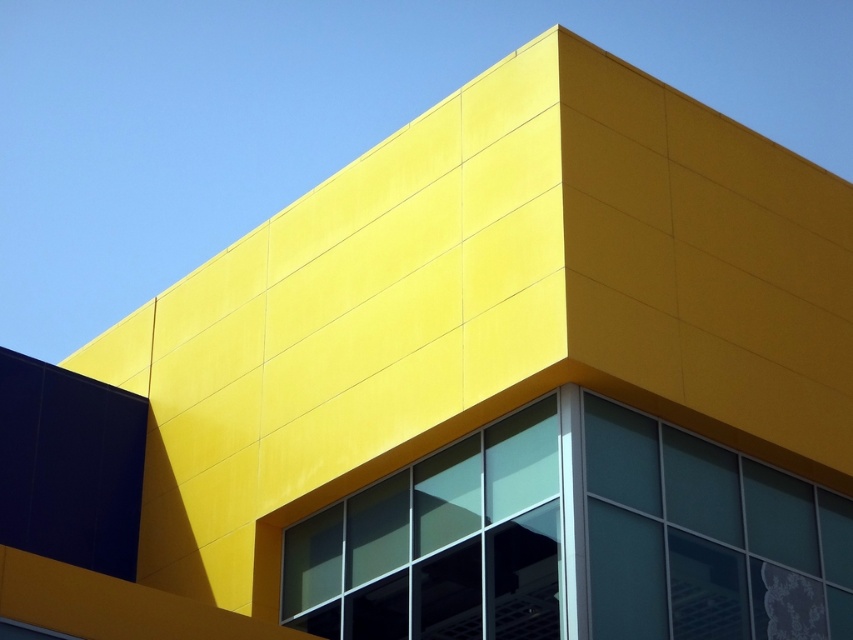
Looking at this image, you are standing outside the modern building and want to look through the windows. Which window would allow you to see the interior more clearly, the clear glass window at center or the transparent glass window at center?

The clear glass window at center is positioned over the transparent glass window at center. Since clear glass typically allows more visibility than transparent glass, the clear glass window at center would allow you to see the interior more clearly.

Looking at this image, based on the scene description, can you determine if the point at coordinates (706,538) is part of the yellow facade or the transparent glass window?

The point at coordinates (706,538) is part of the transparent glass window at lower right, as the Objects Description states that the window is represented by that point.

You are an architect reviewing the building design. You notice two windows, the clear glass window at center and the transparent glass window at lower right. Which window is closer to the front of the building?

The clear glass window at center is closer to the front of the building since it is positioned in front of the transparent glass window at lower right.